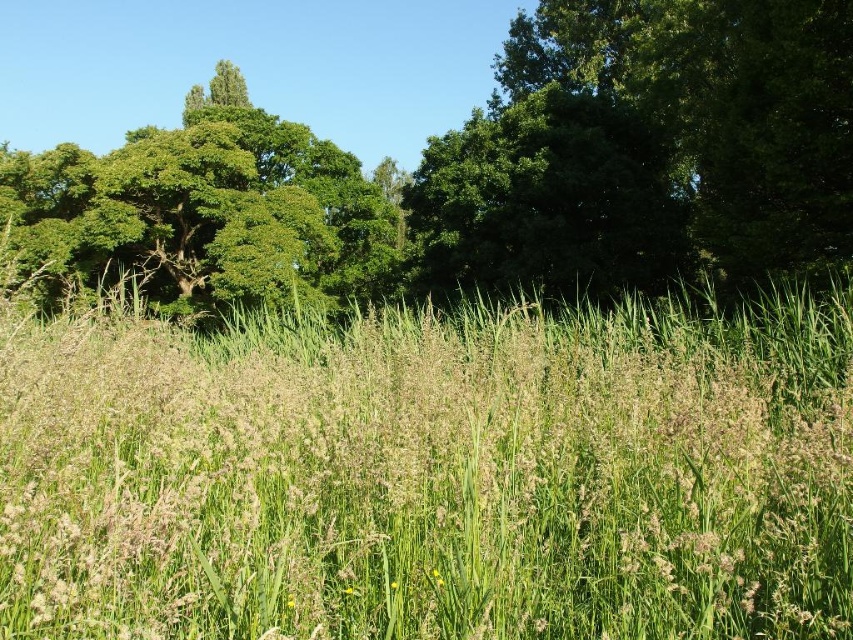
You are standing in the lush landscape and want to take a photo of the green leafy tree at upper left and the green grassy field at center. Which object is positioned to the right side of the other?

The green grassy field at center is to the right of the green leafy tree at upper left.

You are a bird looking for a place to perch. You see two trees in the distance, the green leafy tree at upper center and the green leafy tree at upper left. Which tree is closer to you?

The green leafy tree at upper center is closer to you because it is only 2.31 meters away from the green leafy tree at upper left, which is farther away.

You are standing at the origin point in the image. Where is the green grassy field at center located in relation to your current position?

The green grassy field at center is located at coordinates point (430, 477) relative to the origin point.